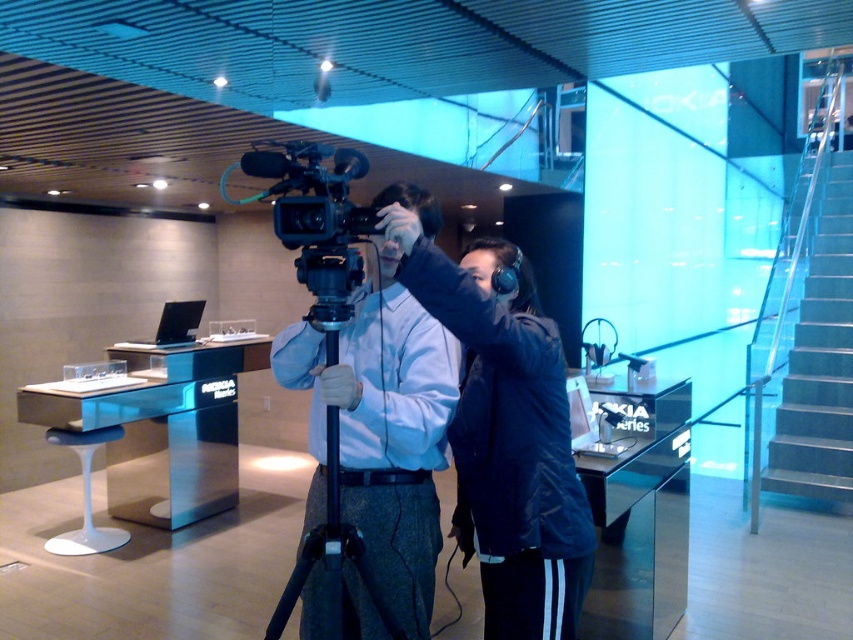
Consider the image. You are standing at the entrance of the room and want to locate the black plastic video camera at center. According to the coordinates provided, where should you look to find it?

The black plastic video camera at center is located at coordinates point (316, 218), which is in the lower central area of the room.

You are setting up equipment for a video shoot in the described space. You have a black plastic video camera at center and a black plastic tripod at center. Which object has a smaller width?

The black plastic video camera at center has a smaller width than the black plastic tripod at center according to the description.

You are a photographer setting up for a photoshoot in the described space. You need to position a light source between the dark blue jacket at center and the black plastic tripod at center. Which object should the light be placed closer to, considering their heights?

The dark blue jacket at center is taller than the black plastic tripod at center, so the light should be placed closer to the dark blue jacket at center to ensure proper illumination based on their heights.